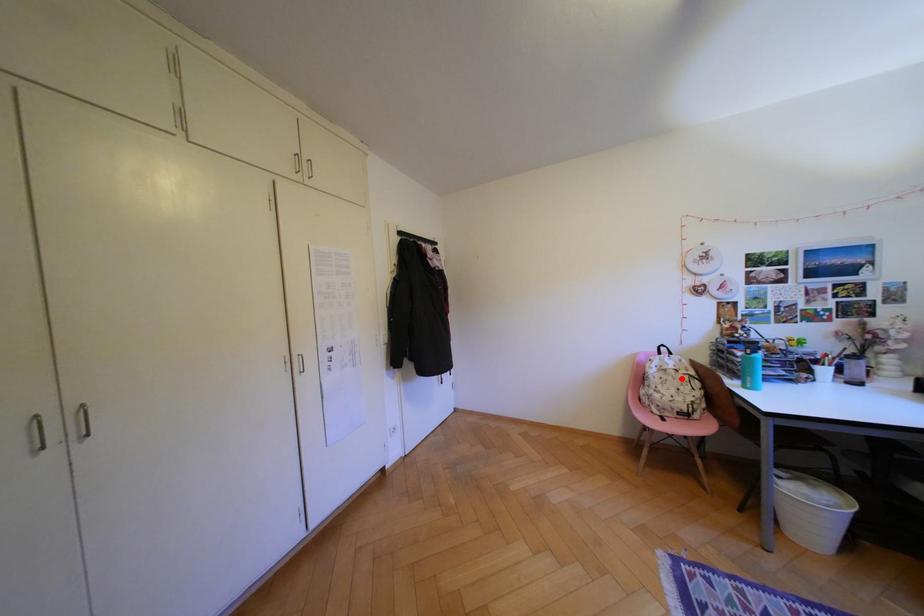
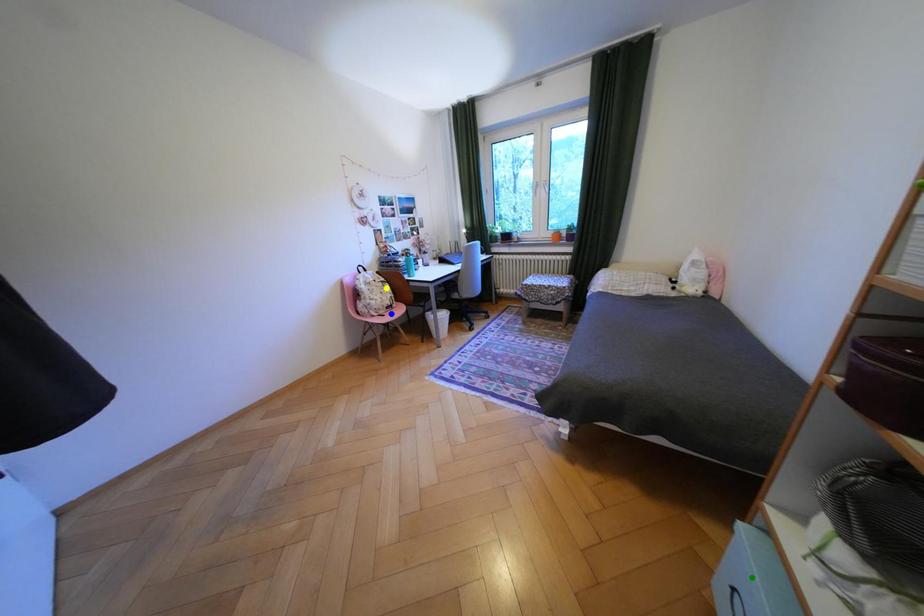
Question: I am providing you with two images of the same scene from different viewpoints. A red point is marked on the first image. You are given multiple points on the second image. Which point in image 2 is actually the same real-world point as the red point in image 1?

Choices:
 (A) yellow point
 (B) green point
 (C) blue point

Answer: (A)